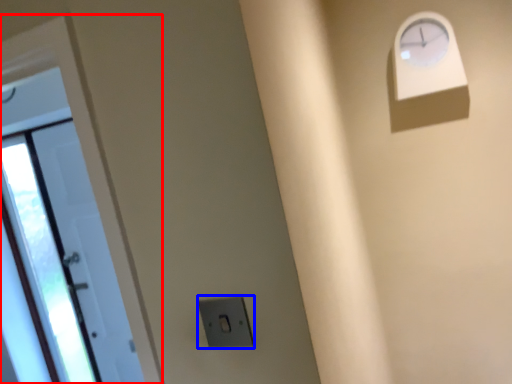
Question: Which point is closer to the camera, door (highlighted by a red box) or electric outlet (highlighted by a blue box)?

Choices:
 (A) door
 (B) electric outlet

Answer: (B)